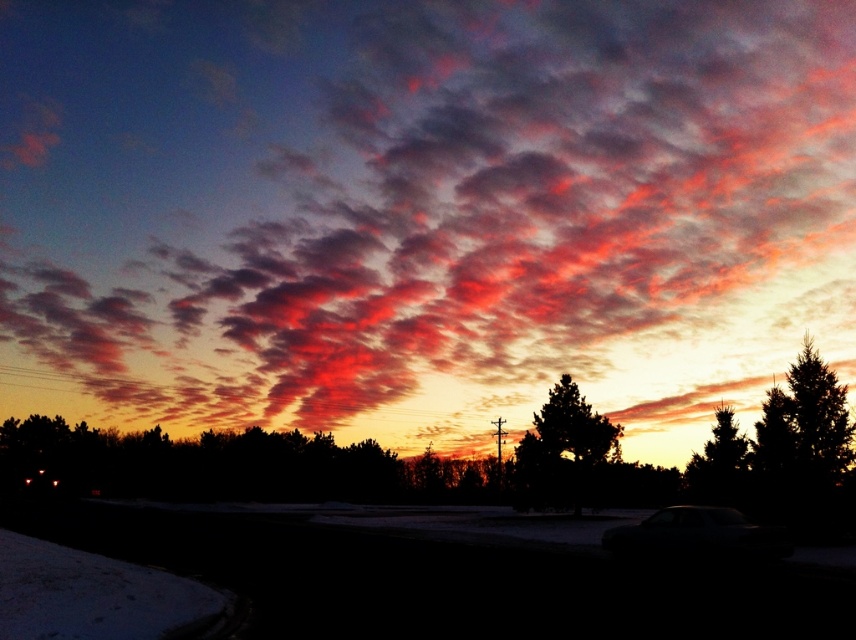
You are driving along the road and notice two trees in the distance. The dark green textured tree at center and the green leafy tree at right. Which tree appears closer to the road based on their positions in the image?

The dark green textured tree at center is located below the green leafy tree at right, so it appears closer to the road since it is positioned lower in the image.